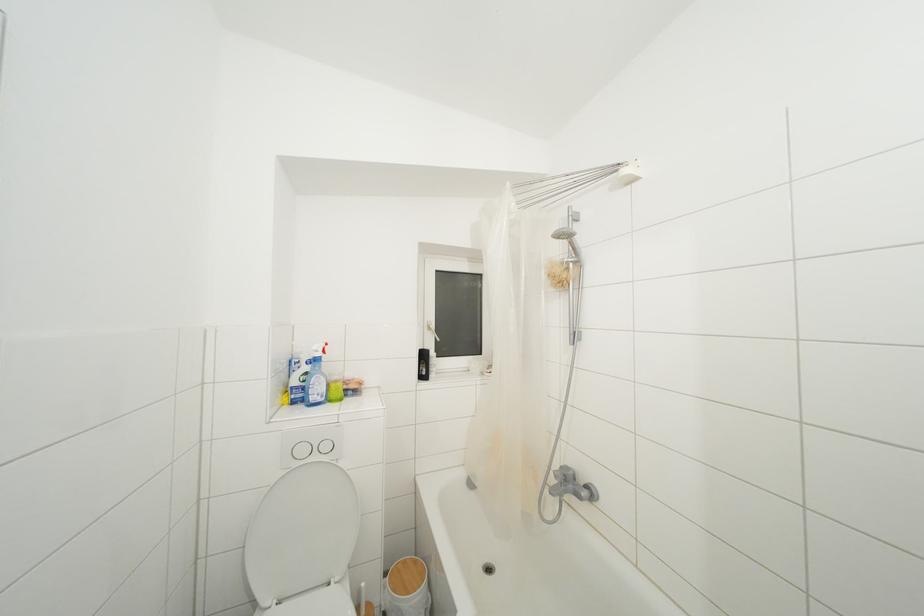
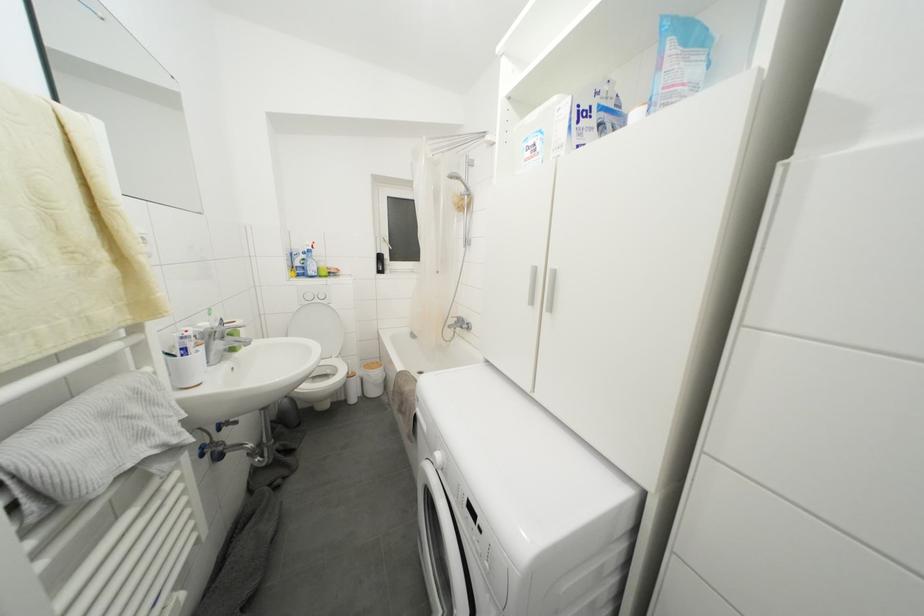
The images are taken continuously from a first-person perspective. In which direction are you moving?

The movement direction of the cameraman is right, backward.